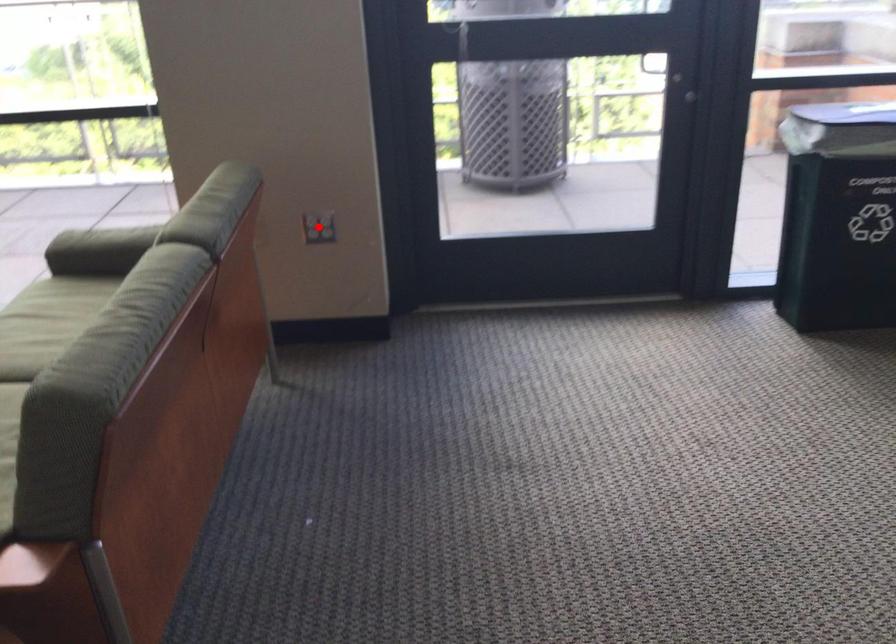
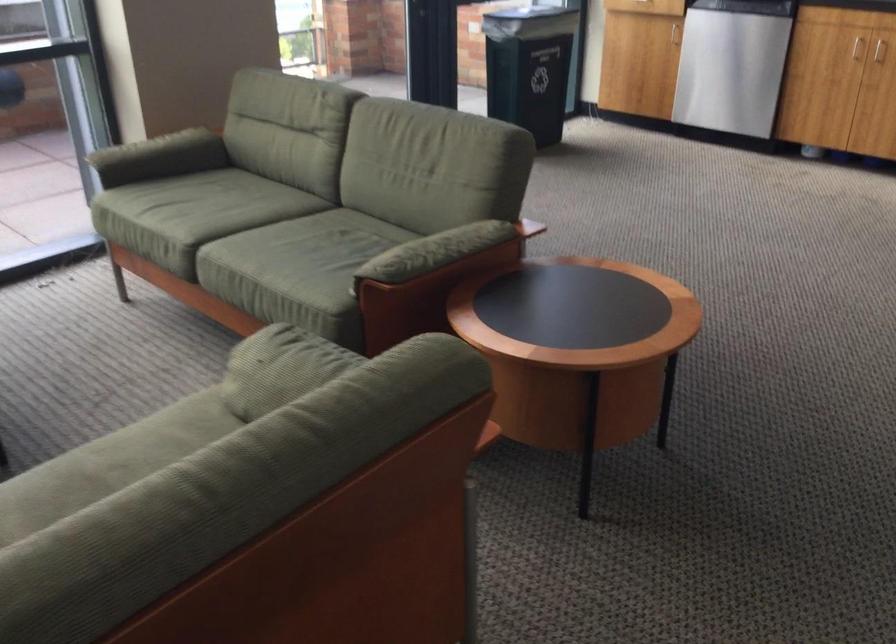
Question: I am providing you with two images of the same scene from different viewpoints. A red point is marked on the first image. At the location where the point appears in image 1, is it still visible in image 2?

Choices:
 (A) Yes
 (B) No

Answer: (B)